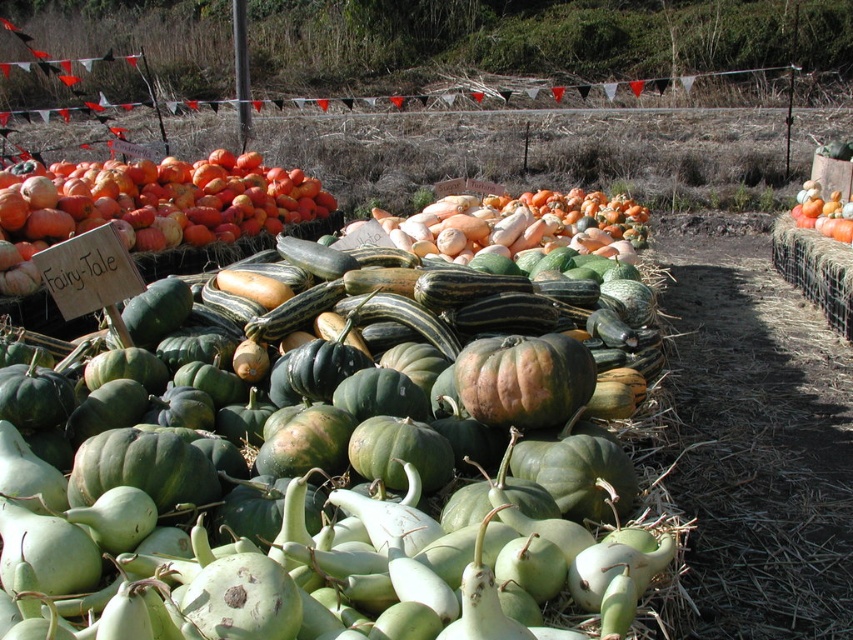
You are setting up a display for a fall festival and need to arrange the green matte gourd at center and the rough textured pumpkin at center. Which object should be placed higher on the shelf to ensure it is visible above the other?

The green matte gourd at center should be placed higher on the shelf since it is taller than the rough textured pumpkin at center, allowing it to naturally stand out above the pumpkin.

You are setting up a display at the farm stand and need to arrange the green matte gourd at center and the rough textured pumpkin at center. According to the current layout, which object should be placed to the left side of the display?

The green matte gourd at center should be placed to the left side of the display because it is currently positioned to the left of the rough textured pumpkin at center.

You are a farmer who wants to place a new decorative statue between the green matte gourd at center and the orange matte pumpkin at center. The statue requires 4 meters of space between the two objects to be placed safely. Can you place the statue there?

The green matte gourd at center and orange matte pumpkin at center are 4.18 meters apart from each other, so yes, the statue can be placed between them since the distance is more than the required 4 meters.